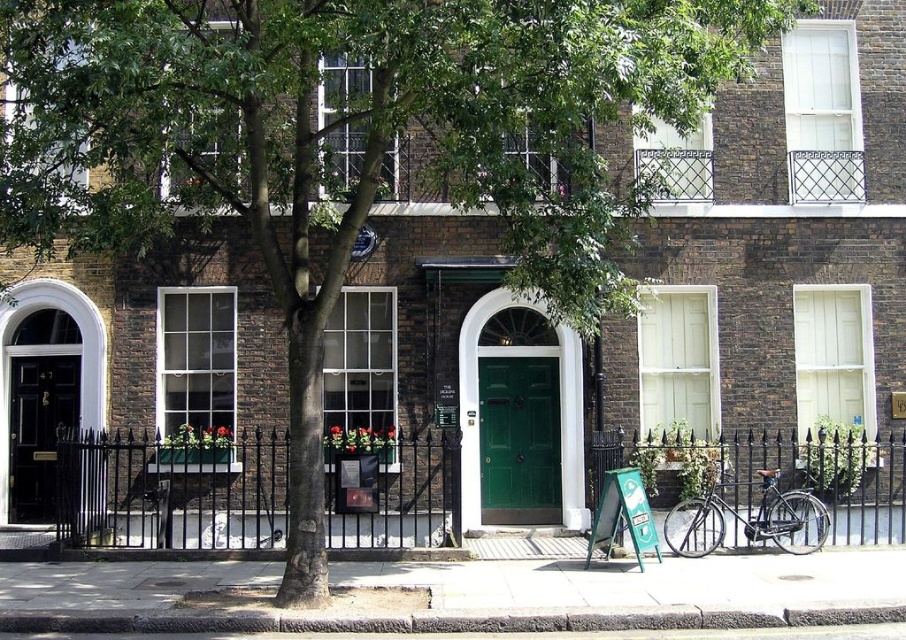
Question: Is green matte door at center below black glossy door at left?

Choices:
 (A) no
 (B) yes

Answer: (B)

Question: Which point appears farthest from the camera in this image?

Choices:
 (A) (764, 524)
 (B) (63, 364)

Answer: (B)

Question: Is green matte door at center further to camera compared to shiny black bicycle at lower right?

Choices:
 (A) yes
 (B) no

Answer: (A)

Question: Does green matte door at center have a smaller size compared to shiny black bicycle at lower right?

Choices:
 (A) yes
 (B) no

Answer: (A)

Question: Which object is positioned closest to the black glossy door at left?

Choices:
 (A) green matte door at center
 (B) shiny black bicycle at lower right

Answer: (A)

Question: Which of these objects is positioned closest to the shiny black bicycle at lower right?

Choices:
 (A) black glossy door at left
 (B) green matte door at center

Answer: (B)